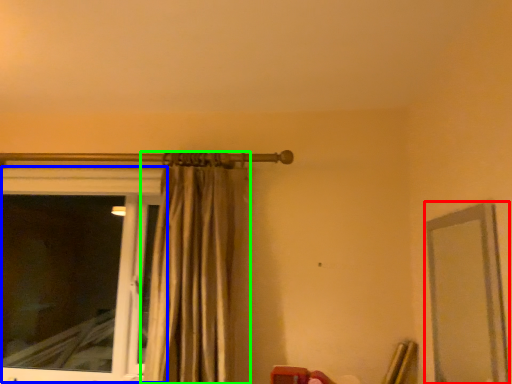
Question: Which is nearer to the mirror (highlighted by a red box)? window (highlighted by a blue box) or curtain (highlighted by a green box).

Choices:
 (A) window
 (B) curtain

Answer: (B)